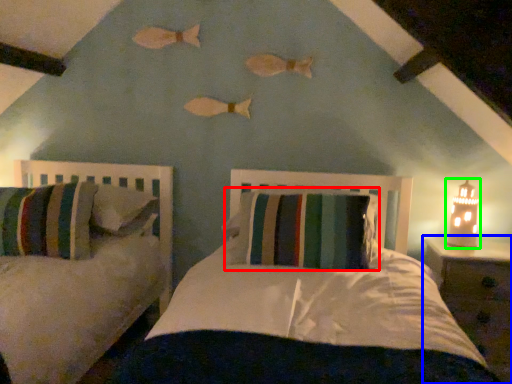
Question: Which object is positioned farthest from pillow (highlighted by a red box)? Select from nightstand (highlighted by a blue box) and table lamp (highlighted by a green box).

Choices:
 (A) nightstand
 (B) table lamp

Answer: (B)